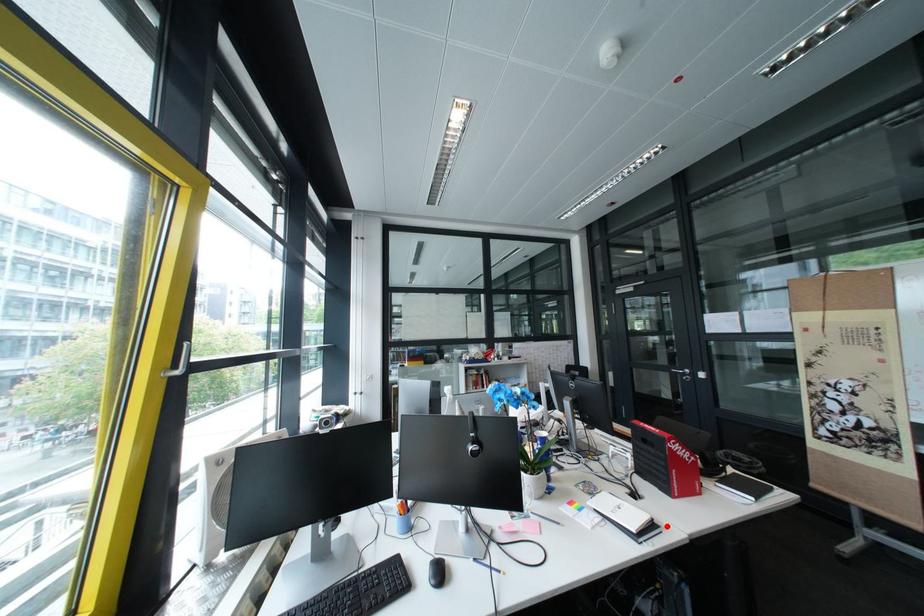
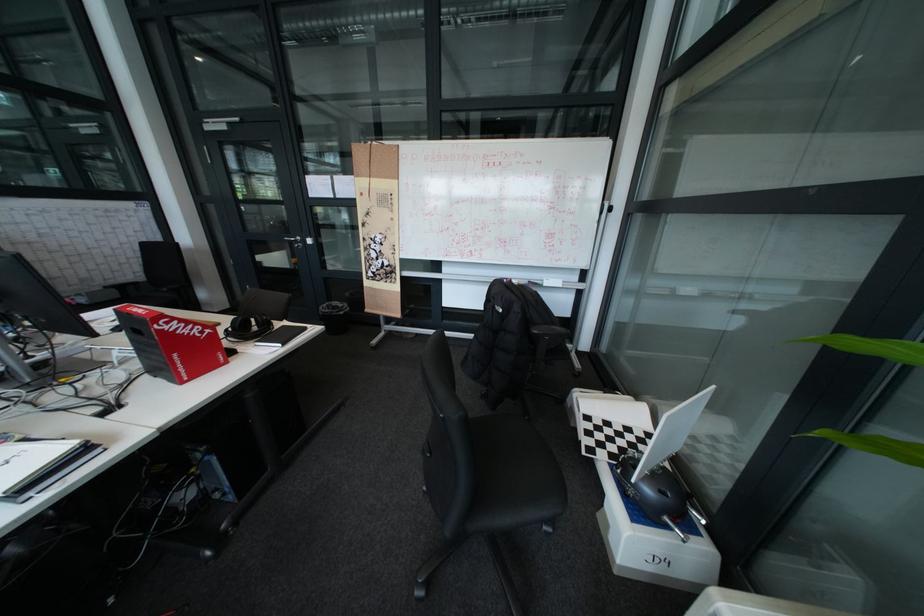
Where in the second image is the point corresponding to the highlighted location from the first image?

(99, 452)